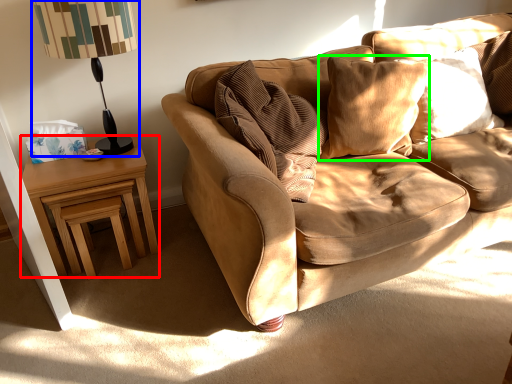
Question: Which is nearer to the nightstand (highlighted by a red box)? table lamp (highlighted by a blue box) or pillow (highlighted by a green box).

Choices:
 (A) table lamp
 (B) pillow

Answer: (A)